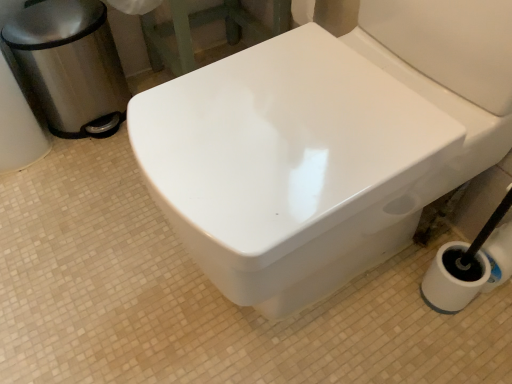
The width and height of the screenshot is (512, 384). In order to click on vacant space situated on the left part of white glossy bidet at center in this screenshot , I will do `click(102, 285)`.